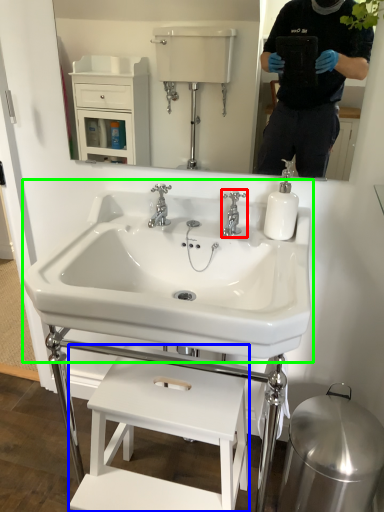
Question: Based on their relative distances, which object is nearer to tap (highlighted by a red box)? Choose from furniture (highlighted by a blue box) and sink (highlighted by a green box).

Choices:
 (A) furniture
 (B) sink

Answer: (B)